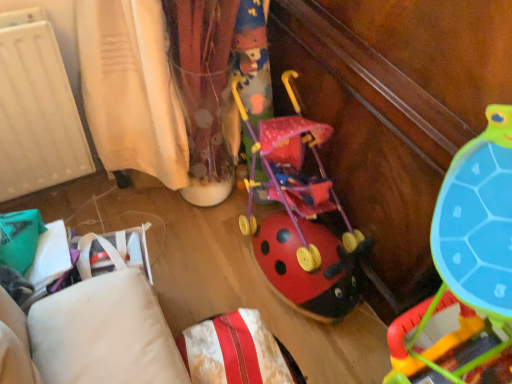
Question: Relative to matte plastic stroller at center, the 1th toy in the top-to-bottom sequence, is velvety white pillow at lower center in front or behind?

Choices:
 (A) front
 (B) behind

Answer: (A)

Question: From a real-world perspective, is velvety white pillow at lower center positioned above or below matte plastic stroller at center, the 1th toy in the top-to-bottom sequence?

Choices:
 (A) below
 (B) above

Answer: (A)

Question: Which is farther from the velvety white pillow at lower center?

Choices:
 (A) rubberized plastic ladybug stroller at center, arranged as the first toy when ordered from the bottom
 (B) matte plastic stroller at center, the second toy in the bottom-to-top sequence

Answer: (B)

Question: Which object is the closest to the velvety white pillow at lower center?

Choices:
 (A) matte plastic stroller at center, the second toy in the bottom-to-top sequence
 (B) rubberized plastic ladybug stroller at center, the 2th toy viewed from the top

Answer: (B)